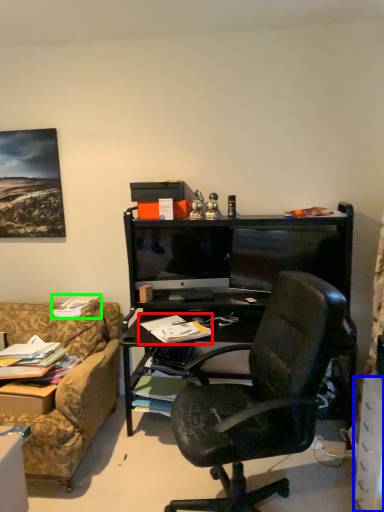
Question: Which is nearer to the book (highlighted by a red box)? drawer (highlighted by a blue box) or book (highlighted by a green box).

Choices:
 (A) drawer
 (B) book

Answer: (B)